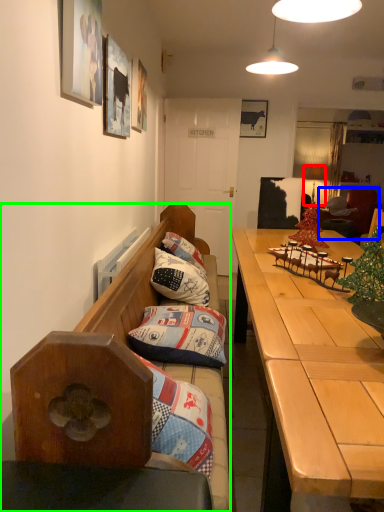
Question: Which is farther away from lamp (highlighted by a red box)? bean bag chair (highlighted by a blue box) or studio couch (highlighted by a green box)?

Choices:
 (A) bean bag chair
 (B) studio couch

Answer: (B)